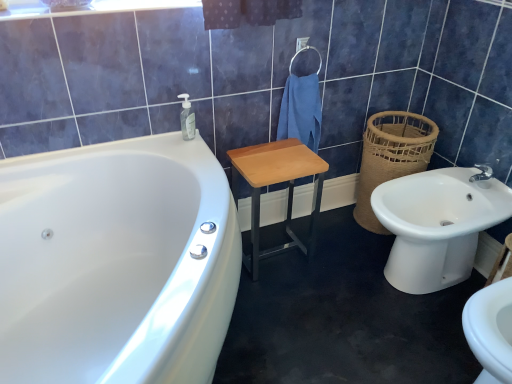
The image size is (512, 384). In order to click on vacant area that is in front of white ceramic sink at right in this screenshot , I will do `click(412, 338)`.